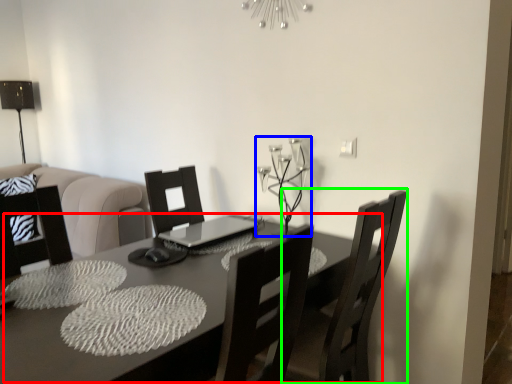
Question: Based on their relative distances, which object is farther from table (highlighted by a red box)? Choose from candle holder (highlighted by a blue box) and chair (highlighted by a green box).

Choices:
 (A) candle holder
 (B) chair

Answer: (A)